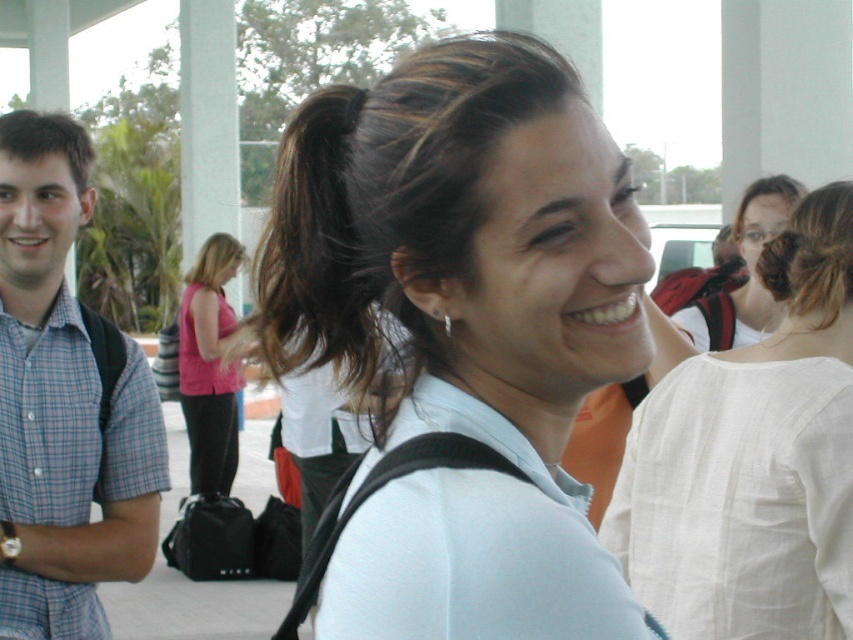
Question: Does white matte shirt at center have a greater width compared to pink fabric shirt at center?

Choices:
 (A) no
 (B) yes

Answer: (A)

Question: Which of the following is the farthest from the observer?

Choices:
 (A) (782, 189)
 (B) (416, 355)
 (C) (190, 481)
 (D) (780, 294)

Answer: (C)

Question: Where is dark brown silky hair at upper right located in relation to brown matte hair at left in the image?

Choices:
 (A) above
 (B) below

Answer: (B)

Question: Among these points, which one is farthest from the camera?

Choices:
 (A) (363, 536)
 (B) (206, 426)
 (C) (86, 145)
 (D) (213, 264)

Answer: (D)

Question: Is blue plaid shirt at left to the right of brown matte hair at left from the viewer's perspective?

Choices:
 (A) yes
 (B) no

Answer: (A)

Question: Which point is farther from the camera taking this photo?

Choices:
 (A) (770, 227)
 (B) (527, 321)

Answer: (A)